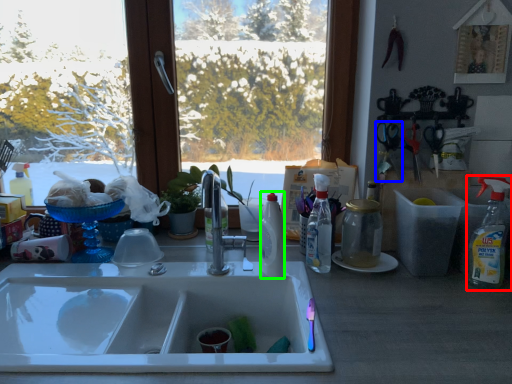
Question: Which object is positioned farthest from cleaning product (highlighted by a red box)? Select from scissors (highlighted by a blue box) and bottle (highlighted by a green box).

Choices:
 (A) scissors
 (B) bottle

Answer: (B)